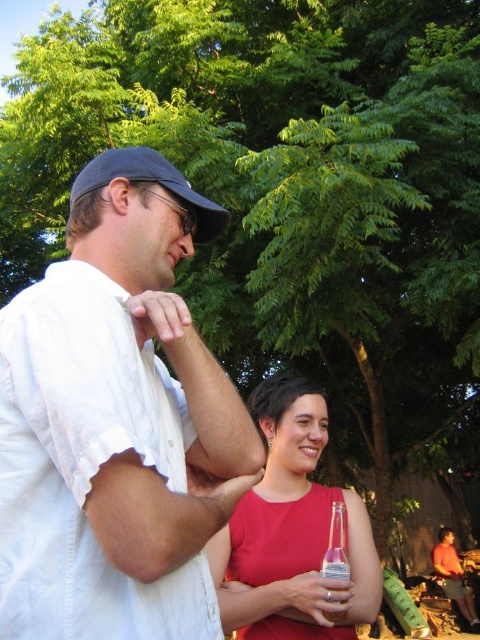
You are a photographer trying to capture a clear shot of both the white cotton shirt at left and the matte red dress at center. Which one should you focus on first to ensure both are in focus?

The white cotton shirt at left is closer to the viewer than the matte red dress at center, so focus on the white cotton shirt at left first. This way, the depth of field will naturally include the matte red dress at center in focus as well.

You are a delivery robot that is 0.8 meters wide. You need to move from the right side of the image to the left side. There is a white cotton shirt at left and a clear glass bottle at center in your path. Can you pass between them without touching either?

The distance between the white cotton shirt at left and the clear glass bottle at center is 1.07 meters. Since the robot is 0.8 meters wide, there is enough space to pass through without touching either object.

You are a photographer trying to focus on two points in an image. The first point is at coordinates point (106,198) and the second is at point (265,616). Which point should you focus on first if you want to capture the closest object to the camera?

Point (106,198) is closer to the camera than point (265,616), so you should focus on point (106,198) first to capture the closest object.